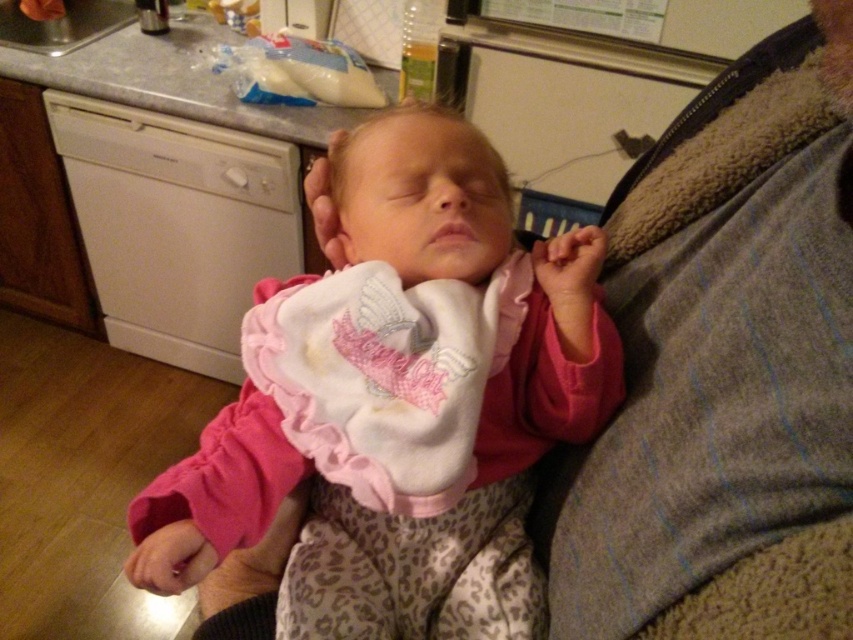
You are a photographer trying to capture the baby in the center of the image. You notice a point at coordinates [399,403]. Is this point located on the baby?

Yes, the point at coordinates [399,403] is located on the baby because the Objects Description states that it is on the pink fleece baby at center.

You are a photographer trying to capture the baby in the kitchen scene. You need to ensure the pink fleece baby at center and the white soft bib at center are both in the frame. Which object should be placed to the left to ensure the bib is visible alongside the baby?

The white soft bib at center should be placed to the left of the pink fleece baby at center to ensure both are visible in the frame since the pink fleece baby at center is currently on the right side of the white soft bib at center.

You are standing in the kitchen scene and want to place a small toy between the two points, point 1 at (390, 586) and point 2 at (392, 339). Which point should the toy be closer to if you want it to be in front of both points?

The toy should be closer to point 2 at (392, 339) because point 1 at (390, 586) is behind point 2, so placing it near point 2 would position it in front of both points.